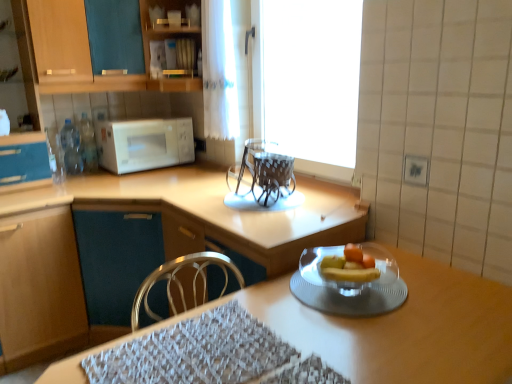
Question: Can you confirm if matte wood cabinet at left, which ranks as the second cabinetry in top-to-bottom order, is shorter than wooden table at center?

Choices:
 (A) no
 (B) yes

Answer: (A)

Question: Can you confirm if matte wood cabinet at left, which ranks as the second cabinetry in top-to-bottom order, is positioned to the left of wooden table at center?

Choices:
 (A) no
 (B) yes

Answer: (B)

Question: From a real-world perspective, is matte wood cabinet at left, which ranks as the second cabinetry in top-to-bottom order, below wooden table at center?

Choices:
 (A) yes
 (B) no

Answer: (B)

Question: Considering the relative sizes of matte wood cabinet at left, which ranks as the second cabinetry in top-to-bottom order, and wooden table at center in the image provided, is matte wood cabinet at left, which ranks as the second cabinetry in top-to-bottom order, wider than wooden table at center?

Choices:
 (A) yes
 (B) no

Answer: (A)

Question: Considering the relative sizes of matte wood cabinet at left, which ranks as the second cabinetry in top-to-bottom order, and wooden table at center in the image provided, is matte wood cabinet at left, which ranks as the second cabinetry in top-to-bottom order, thinner than wooden table at center?

Choices:
 (A) yes
 (B) no

Answer: (B)

Question: Is matte wood cabinet at left, which appears as the second cabinetry when ordered from the bottom, not near wooden table at center?

Choices:
 (A) yes
 (B) no

Answer: (B)

Question: Is transparent glass window at center surrounded by transparent plastic chairs at center?

Choices:
 (A) yes
 (B) no

Answer: (B)

Question: Does transparent plastic chairs at center appear on the right side of transparent glass window at center?

Choices:
 (A) no
 (B) yes

Answer: (A)

Question: Is transparent plastic chairs at center not near transparent glass window at center?

Choices:
 (A) yes
 (B) no

Answer: (A)

Question: Can you confirm if transparent plastic chairs at center is smaller than transparent glass window at center?

Choices:
 (A) yes
 (B) no

Answer: (A)

Question: Can we say transparent plastic chairs at center lies outside transparent glass window at center?

Choices:
 (A) no
 (B) yes

Answer: (B)

Question: From a real-world perspective, is transparent plastic chairs at center located higher than transparent glass window at center?

Choices:
 (A) yes
 (B) no

Answer: (B)

Question: Is white glossy microwave at upper left far from transparent plastic chairs at center?

Choices:
 (A) no
 (B) yes

Answer: (A)